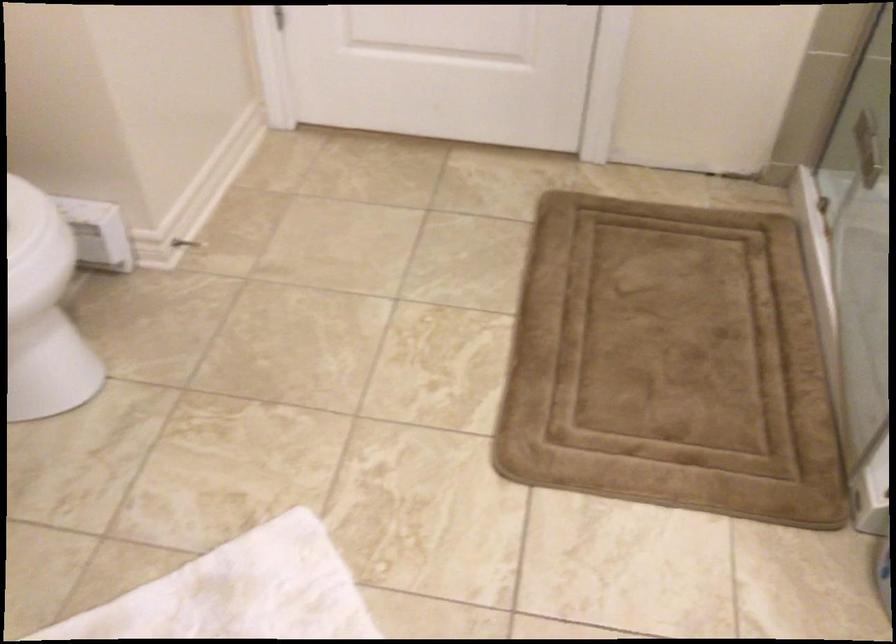
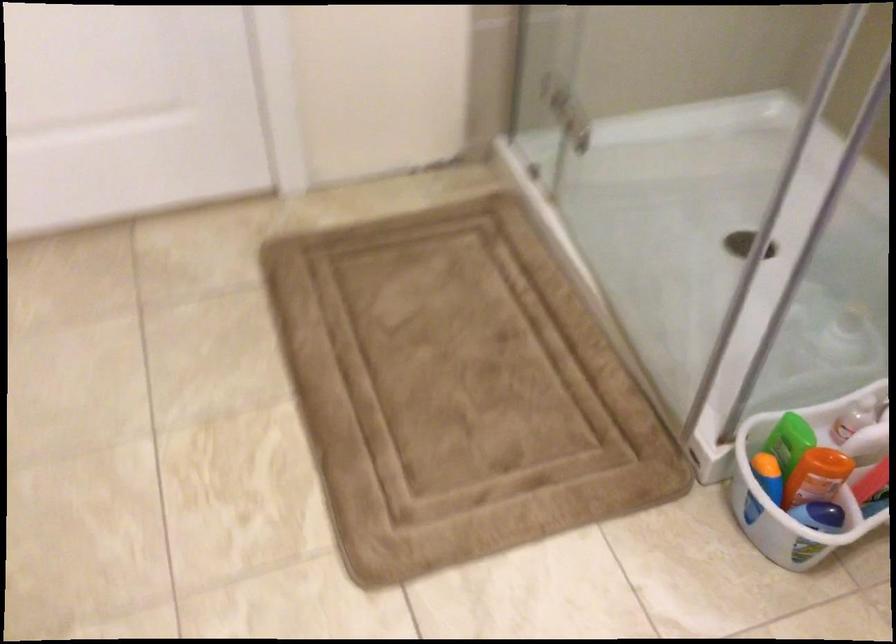
Question: Which direction would the cameraman need to move to produce the second image? Reply with the corresponding letter.

Choices:
 (A) Left
 (B) Right
 (C) Forward
 (D) Backward

Answer: (C)